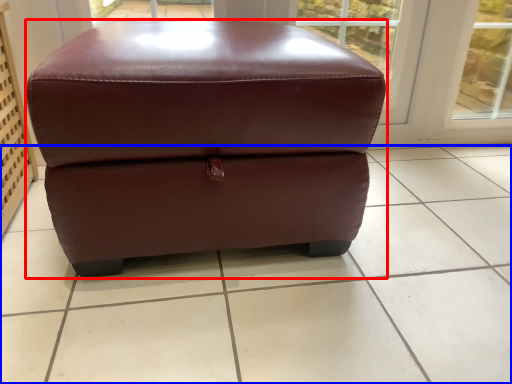
Question: Which of the following is the farthest to the observer, furniture (highlighted by a red box) or tile (highlighted by a blue box)?

Choices:
 (A) furniture
 (B) tile

Answer: (A)